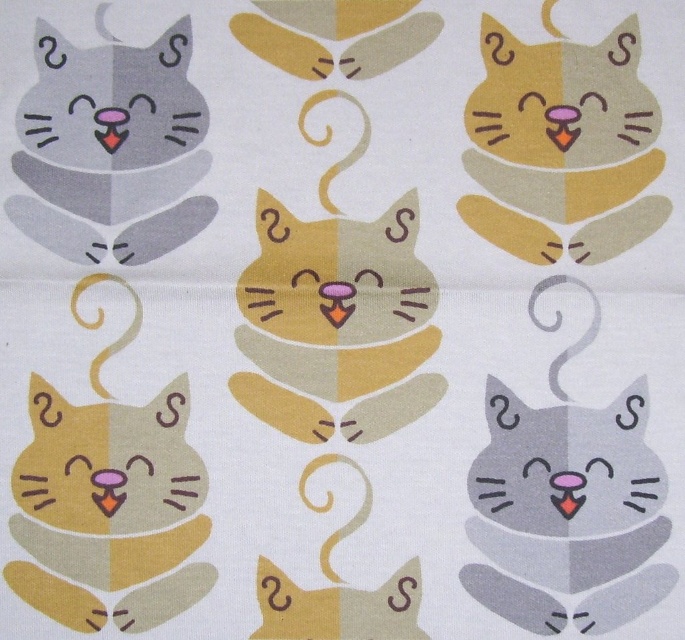
Is matte gray cat at lower right further to camera compared to matte orange cat at upper right?

No, it is not.

Which is behind, point (635, 392) or point (630, 81)?

The point (630, 81) is behind.

You are a GUI agent. You are given a task and a screenshot of the screen. Output one action in this format:
    pyautogui.click(x=<x>, y=<y>)
    Task: Click on the matte gray cat at lower right
    This screenshot has width=685, height=640.
    Given the screenshot: What is the action you would take?
    pyautogui.click(x=560, y=502)

Who is positioned more to the right, matte gray cat at lower right or matte yellow cat at lower left?

matte gray cat at lower right is more to the right.

Based on the photo, can you confirm if matte gray cat at lower right is taller than matte yellow cat at lower left?

Indeed, matte gray cat at lower right has a greater height compared to matte yellow cat at lower left.

Between point (506, 506) and point (34, 452), which one is positioned in front?

Point (506, 506)

Find the location of a particular element. matte gray cat at lower right is located at coordinates (560, 502).

Image resolution: width=685 pixels, height=640 pixels. What do you see at coordinates (556, 136) in the screenshot?
I see `matte orange cat at upper right` at bounding box center [556, 136].

Consider the image. Between matte orange cat at upper right and matte gray cat at upper left, which one has more height?

matte orange cat at upper right

Is point (603, 252) positioned before point (45, 100)?

Yes, point (603, 252) is in front of point (45, 100).

This screenshot has width=685, height=640. In order to click on matte orange cat at upper right in this screenshot , I will do `click(556, 136)`.